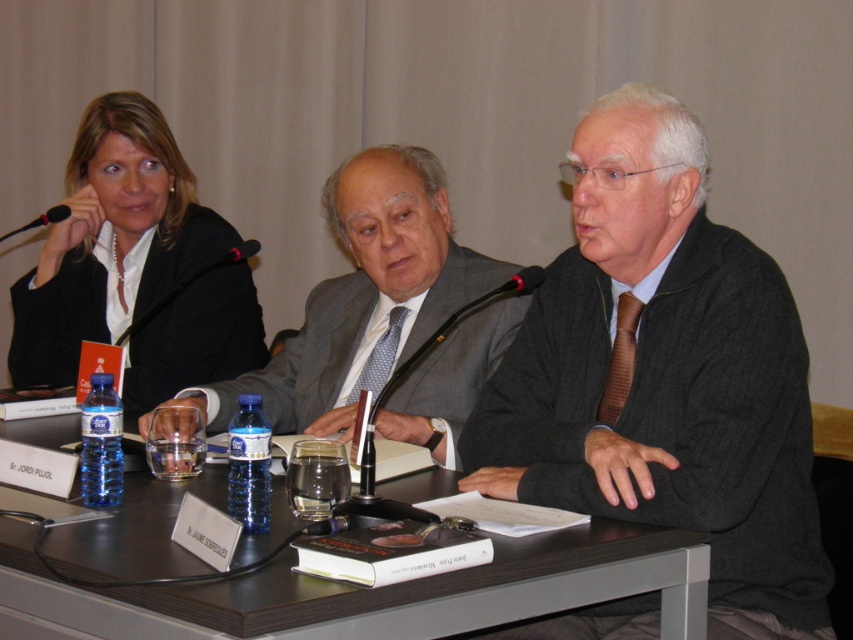
Question: Which of the following is the closest to the observer?

Choices:
 (A) (265, 381)
 (B) (584, 534)

Answer: (B)

Question: Is gray wool suit at center closer to the viewer compared to black plastic microphone at upper left?

Choices:
 (A) no
 (B) yes

Answer: (B)

Question: Which point is farther to the camera?

Choices:
 (A) (144, 323)
 (B) (167, 221)
 (C) (54, 529)
 (D) (277, 392)

Answer: (B)

Question: Estimate the real-world distances between objects in this image. Which object is closer to the dark wood table at center?

Choices:
 (A) black plastic microphone at upper center
 (B) matte black jacket at upper left
 (C) black plastic microphone at upper left
 (D) gray wool suit at center

Answer: (D)

Question: Where is dark wood table at center located in relation to black plastic microphone at upper center in the image?

Choices:
 (A) left
 (B) right

Answer: (B)

Question: Is brown textured sweater at center to the left of matte black jacket at upper left from the viewer's perspective?

Choices:
 (A) no
 (B) yes

Answer: (A)